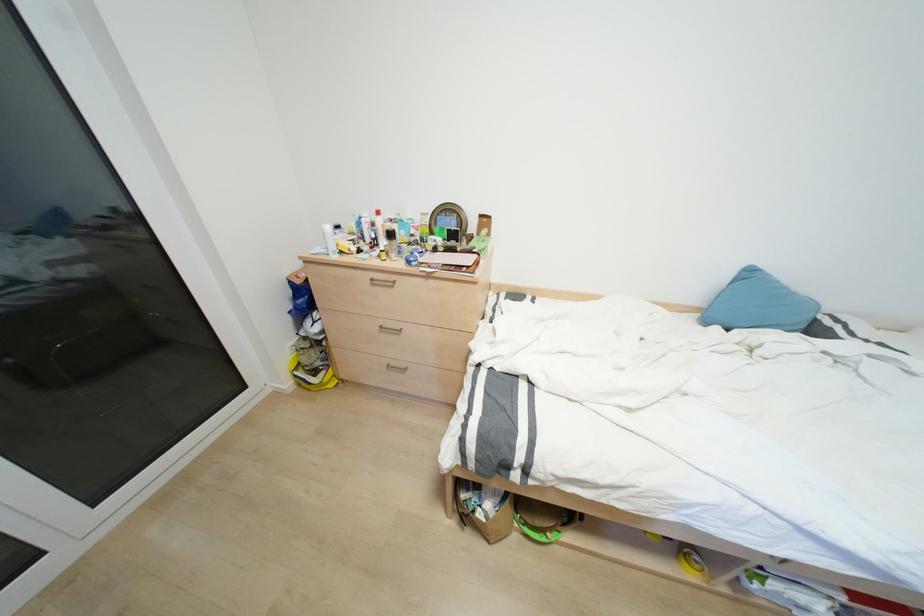
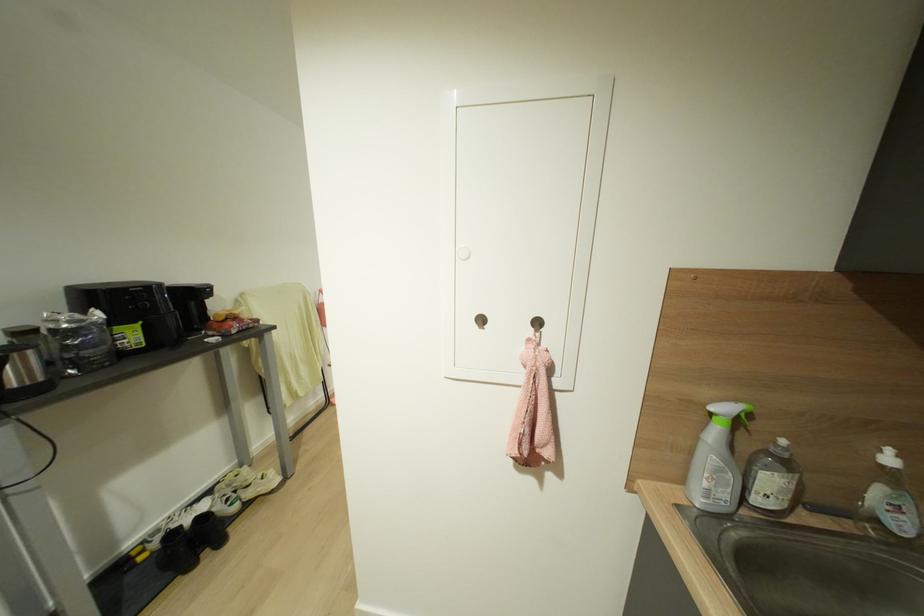
Question: I am providing you with two images of the same scene from different viewpoints. Please identify which objects are invisible in image2.

Choices:
 (A) soap dispenser pump
 (B) black spray can
 (C) silver electric kettle
 (D) orange bucket

Answer: (B)